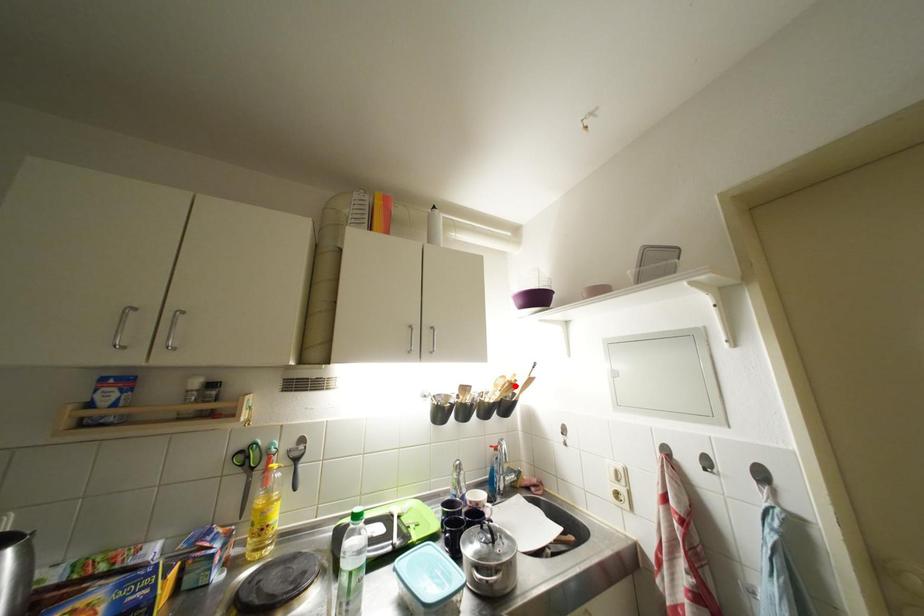
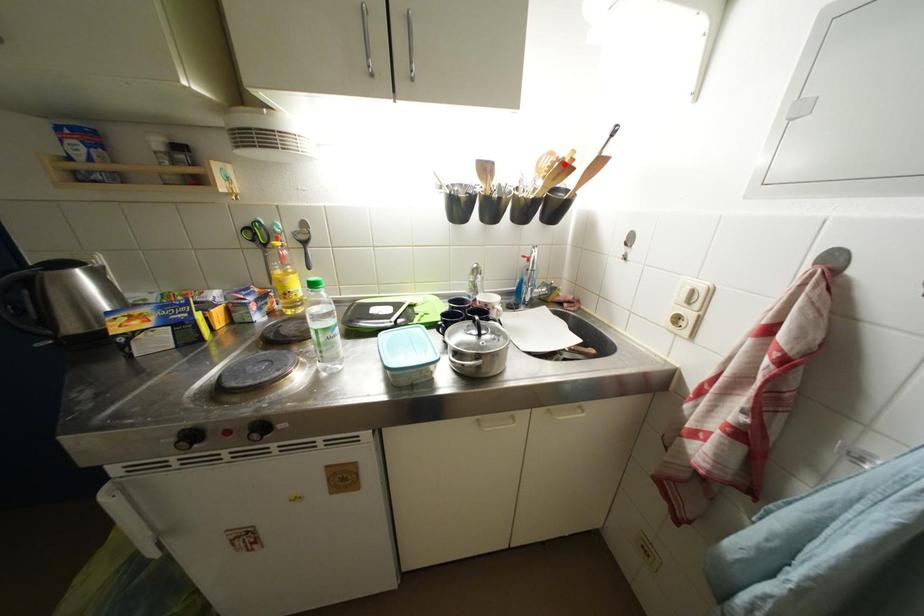
I am providing you with two images of the same scene from different viewpoints. A red point is marked on the first image and another point is marked on the second image. Is the marked point in image1 the same physical position as the marked point in image2?

Yes